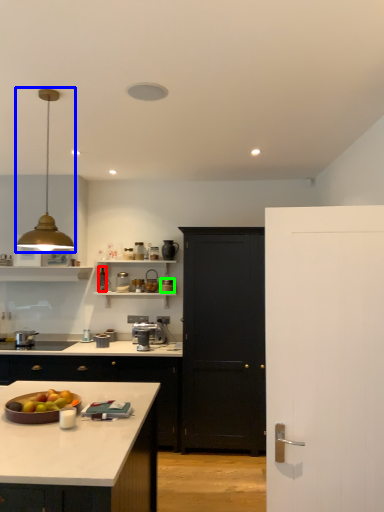
Question: Estimate the real-world distances between objects in this image. Which object is closer to appliance (highlighted by a red box), light fixture (highlighted by a blue box) or appliance (highlighted by a green box)?

Choices:
 (A) light fixture
 (B) appliance

Answer: (B)